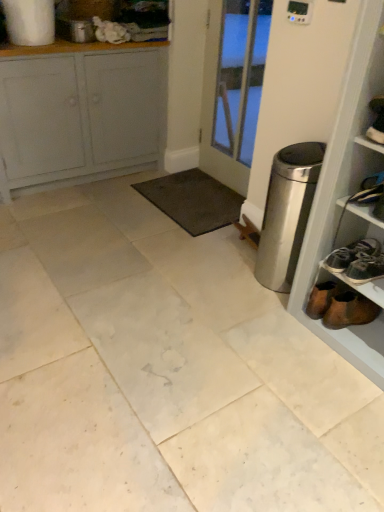
At what (x,y) coordinates should I click in order to perform the action: click on blank area to the left of stainless steel trash can at right. Please return your answer as a coordinate pair (x, y). Image resolution: width=384 pixels, height=512 pixels. Looking at the image, I should click on (228, 272).